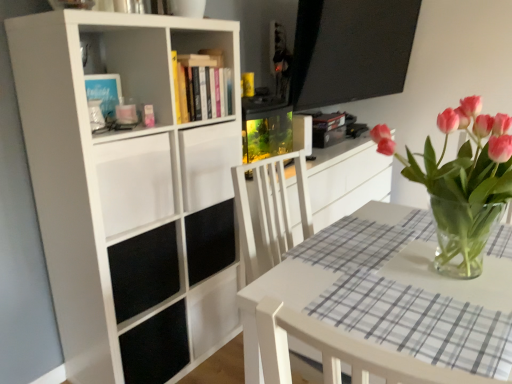
Question: Can you confirm if white matte bookcase at left is bigger than pink glass vase at center?

Choices:
 (A) no
 (B) yes

Answer: (B)

Question: Is white matte bookcase at left far from pink glass vase at center?

Choices:
 (A) no
 (B) yes

Answer: (A)

Question: Is pink glass vase at center a part of white matte bookcase at left?

Choices:
 (A) yes
 (B) no

Answer: (B)

Question: Is white matte bookcase at left facing away from pink glass vase at center?

Choices:
 (A) yes
 (B) no

Answer: (B)

Question: From the image's perspective, is white matte bookcase at left located beneath pink glass vase at center?

Choices:
 (A) yes
 (B) no

Answer: (A)

Question: Is white matte bookcase at left spatially inside white matte drawer at upper left, or outside of it?

Choices:
 (A) inside
 (B) outside

Answer: (B)

Question: From the image's perspective, relative to white matte drawer at upper left, is white matte bookcase at left above or below?

Choices:
 (A) below
 (B) above

Answer: (A)

Question: Relative to white matte drawer at upper left, is white matte bookcase at left in front or behind?

Choices:
 (A) behind
 (B) front

Answer: (B)

Question: Considering the positions of point (33, 29) and point (124, 196), is point (33, 29) closer or farther from the camera than point (124, 196)?

Choices:
 (A) farther
 (B) closer

Answer: (B)

Question: Based on their sizes in the image, would you say white matte bookcase at left is bigger or smaller than white wood chair at lower right?

Choices:
 (A) small
 (B) big

Answer: (B)

Question: Would you say white matte bookcase at left is to the left or to the right of white wood chair at lower right in the picture?

Choices:
 (A) left
 (B) right

Answer: (A)

Question: Would you say white matte bookcase at left is inside or outside white wood chair at lower right?

Choices:
 (A) outside
 (B) inside

Answer: (A)

Question: From the image's perspective, relative to white wood chair at lower right, is white matte bookcase at left above or below?

Choices:
 (A) above
 (B) below

Answer: (A)

Question: In terms of width, does white matte drawer at upper left look wider or thinner when compared to white matte bookcase at left?

Choices:
 (A) wide
 (B) thin

Answer: (A)

Question: From the image's perspective, is white matte drawer at upper left located above or below white matte bookcase at left?

Choices:
 (A) above
 (B) below

Answer: (A)